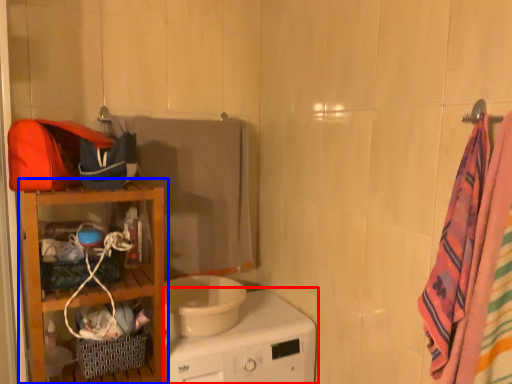
Question: Which object appears farthest to the camera in this image, home appliance (highlighted by a red box) or furniture (highlighted by a blue box)?

Choices:
 (A) home appliance
 (B) furniture

Answer: (B)